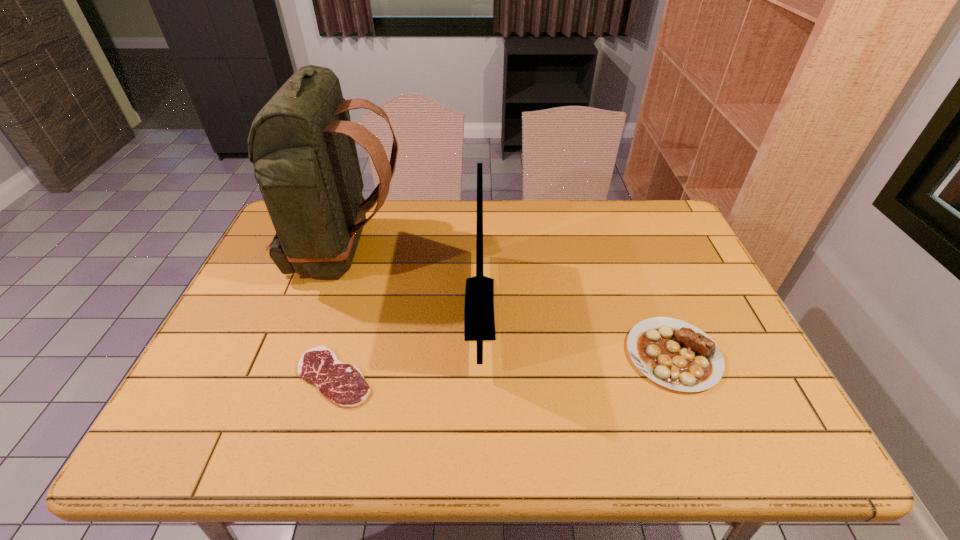
At what (x,y) coordinates should I click in order to perform the action: click on empty space that is in between the monitor and the rightmost object. Please return your answer as a coordinate pair (x, y). The height and width of the screenshot is (540, 960). Looking at the image, I should click on (576, 332).

At what (x,y) coordinates should I click in order to perform the action: click on unoccupied area between the rightmost object and the shorter steak. Please return your answer as a coordinate pair (x, y). Looking at the image, I should click on (504, 366).

Locate an element on the screen. The width and height of the screenshot is (960, 540). vacant area between the right steak and the backpack is located at coordinates (510, 303).

Locate an element on the screen. Image resolution: width=960 pixels, height=540 pixels. vacant space in between the second tallest object and the tallest object is located at coordinates (413, 280).

Find the location of a particular element. This screenshot has width=960, height=540. empty location between the third shortest object and the shorter steak is located at coordinates (407, 342).

At what (x,y) coordinates should I click in order to perform the action: click on free spot between the third shortest object and the right steak. Please return your answer as a coordinate pair (x, y). The height and width of the screenshot is (540, 960). Looking at the image, I should click on (576, 332).

The height and width of the screenshot is (540, 960). Find the location of `free space between the backpack and the taller steak`. free space between the backpack and the taller steak is located at coordinates (510, 303).

Where is `vacant point located between the third shortest object and the shorter steak`? This screenshot has width=960, height=540. vacant point located between the third shortest object and the shorter steak is located at coordinates (407, 342).

Locate an element on the screen. This screenshot has height=540, width=960. free space that is in between the third object from left to right and the shortest object is located at coordinates (407, 342).

Point out which object is positioned as the nearest to the backpack. Please provide its 2D coordinates. Your answer should be formatted as a tuple, i.e. [(x, y)], where the tuple contains the x and y coordinates of a point satisfying the conditions above.

[(479, 323)]